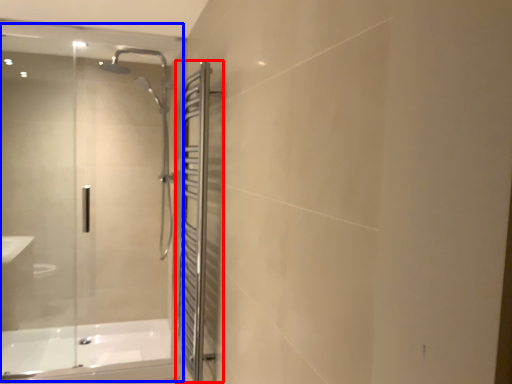
Question: Which object is further to the camera taking this photo, screen door (highlighted by a red box) or glass door (highlighted by a blue box)?

Choices:
 (A) screen door
 (B) glass door

Answer: (B)